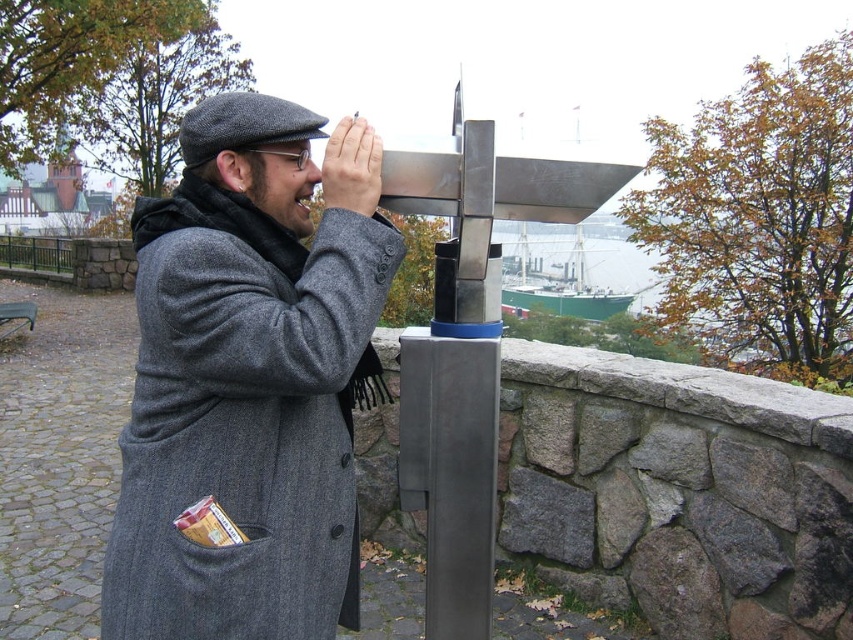
Who is shorter, gray wool coat at center or matte gray nose at center?

matte gray nose at center

Consider the image. Between gray wool coat at center and matte gray nose at center, which one has more height?

Standing taller between the two is gray wool coat at center.

You are a GUI agent. You are given a task and a screenshot of the screen. Output one action in this format:
    pyautogui.click(x=<x>, y=<y>)
    Task: Click on the gray wool coat at center
    This screenshot has height=640, width=853.
    Given the screenshot: What is the action you would take?
    pyautogui.click(x=250, y=380)